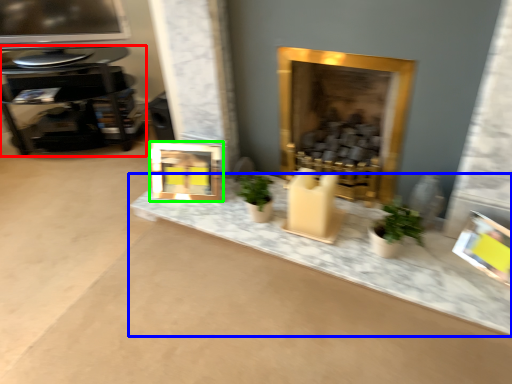
Question: Which object is the farthest from table (highlighted by a red box)? Choose among these: counter top (highlighted by a blue box) or picture frame (highlighted by a green box).

Choices:
 (A) counter top
 (B) picture frame

Answer: (A)